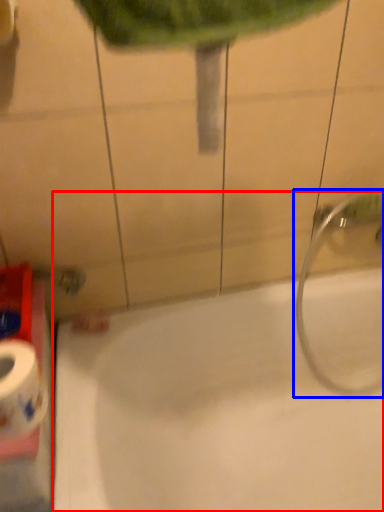
Question: Which object appears farthest to the camera in this image, bathtub (highlighted by a red box) or plumbing fixture (highlighted by a blue box)?

Choices:
 (A) bathtub
 (B) plumbing fixture

Answer: (B)